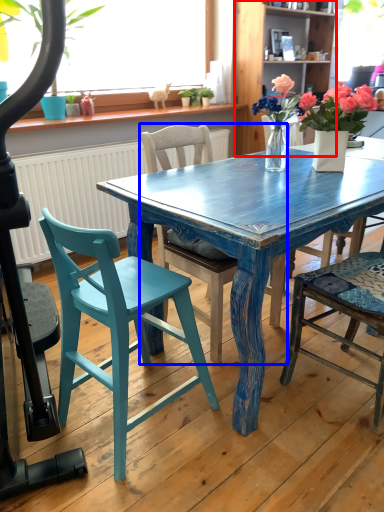
Question: Which object appears farthest to the camera in this image, bookshelf (highlighted by a red box) or chair (highlighted by a blue box)?

Choices:
 (A) bookshelf
 (B) chair

Answer: (A)